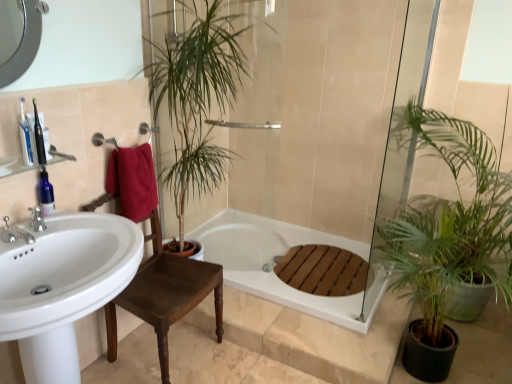
Identify the location of free spot below blue glass toothbrush at upper left (from a real-world perspective). Image resolution: width=512 pixels, height=384 pixels. (49, 224).